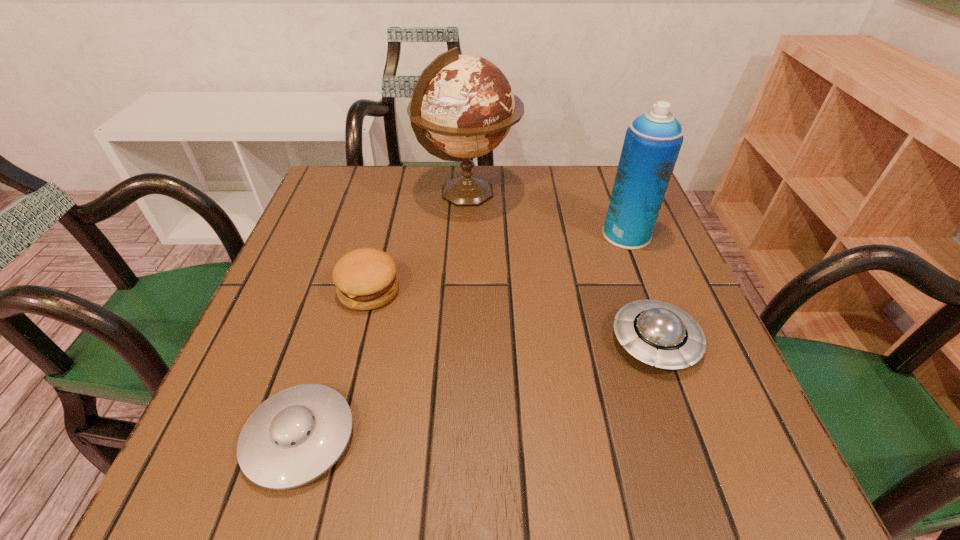
You are a GUI agent. You are given a task and a screenshot of the screen. Output one action in this format:
    pyautogui.click(x=<x>, y=<y>)
    Task: Click on the globe
    Image resolution: width=960 pixels, height=540 pixels.
    Given the screenshot: What is the action you would take?
    pyautogui.click(x=464, y=104)

Locate an element on the screen. the second tallest object is located at coordinates (652, 143).

The width and height of the screenshot is (960, 540). In order to click on hamburger in this screenshot , I will do `click(365, 279)`.

Locate an element on the screen. Image resolution: width=960 pixels, height=540 pixels. the right saucer is located at coordinates (656, 333).

What are the coordinates of `the taller saucer` in the screenshot? It's located at (656, 333).

You are a GUI agent. You are given a task and a screenshot of the screen. Output one action in this format:
    pyautogui.click(x=<x>, y=<y>)
    Task: Click on the left saucer
    
    Given the screenshot: What is the action you would take?
    pyautogui.click(x=296, y=435)

Locate an element on the screen. This screenshot has width=960, height=540. the nearer saucer is located at coordinates (296, 435).

Locate an element on the screen. free spot located on the front of the globe showing Asia is located at coordinates (586, 193).

The width and height of the screenshot is (960, 540). I want to click on vacant point located 0.320m on the left of the second tallest object, so click(x=460, y=234).

Image resolution: width=960 pixels, height=540 pixels. In order to click on vacant region located on the right of the hamburger in this screenshot , I will do `click(527, 291)`.